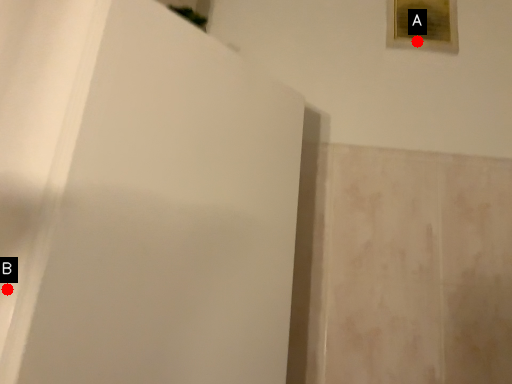
Question: Two points are circled on the image, labeled by A and B beside each circle. Which of the following is the farthest from the observer?

Choices:
 (A) A is further
 (B) B is further

Answer: (A)